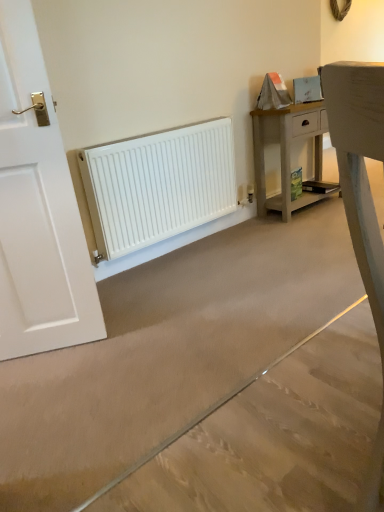
Question: Considering the relative positions of light wood nightstand at upper right and white matte radiator at center in the image provided, is light wood nightstand at upper right behind white matte radiator at center?

Choices:
 (A) yes
 (B) no

Answer: (A)

Question: Considering the relative sizes of light wood nightstand at upper right and white matte radiator at center in the image provided, is light wood nightstand at upper right shorter than white matte radiator at center?

Choices:
 (A) yes
 (B) no

Answer: (B)

Question: Is light wood nightstand at upper right to the right of white matte radiator at center from the viewer's perspective?

Choices:
 (A) yes
 (B) no

Answer: (A)

Question: Does light wood nightstand at upper right have a smaller size compared to white matte radiator at center?

Choices:
 (A) no
 (B) yes

Answer: (B)

Question: Is light wood nightstand at upper right positioned with its back to white matte radiator at center?

Choices:
 (A) yes
 (B) no

Answer: (B)

Question: Is light wood nightstand at upper right outside white matte radiator at center?

Choices:
 (A) no
 (B) yes

Answer: (B)

Question: Considering the relative sizes of white matte radiator at lower left and light wood nightstand at upper right in the image provided, is white matte radiator at lower left thinner than light wood nightstand at upper right?

Choices:
 (A) no
 (B) yes

Answer: (B)

Question: Considering the relative sizes of white matte radiator at lower left and light wood nightstand at upper right in the image provided, is white matte radiator at lower left smaller than light wood nightstand at upper right?

Choices:
 (A) no
 (B) yes

Answer: (B)

Question: Can you see white matte radiator at lower left touching light wood nightstand at upper right?

Choices:
 (A) yes
 (B) no

Answer: (B)

Question: From a real-world perspective, is white matte radiator at lower left positioned under light wood nightstand at upper right based on gravity?

Choices:
 (A) yes
 (B) no

Answer: (B)

Question: From the image's perspective, is white matte radiator at lower left on top of light wood nightstand at upper right?

Choices:
 (A) no
 (B) yes

Answer: (A)

Question: Is white matte radiator at lower left aimed at light wood nightstand at upper right?

Choices:
 (A) no
 (B) yes

Answer: (A)

Question: Does white matte radiator at lower left turn towards white matte radiator at center?

Choices:
 (A) no
 (B) yes

Answer: (B)